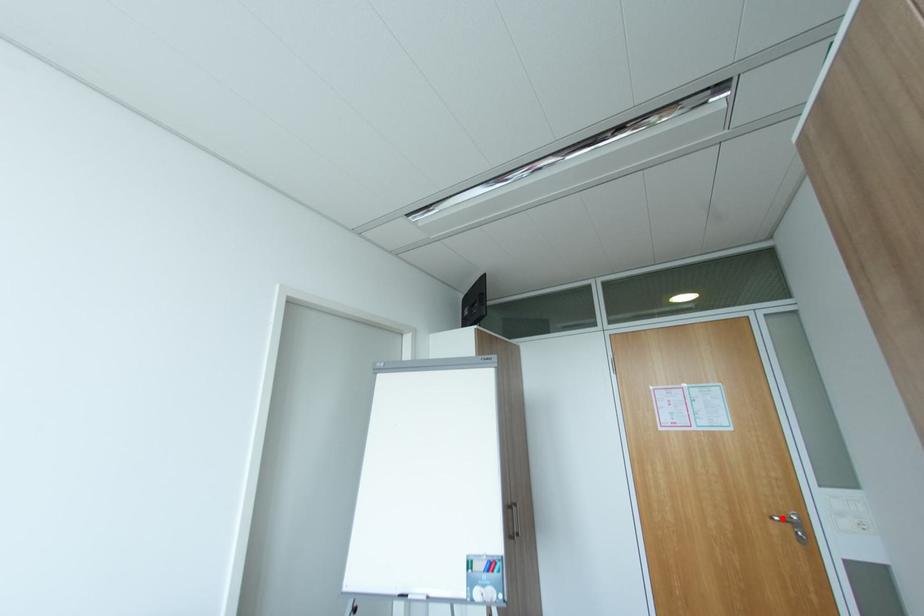
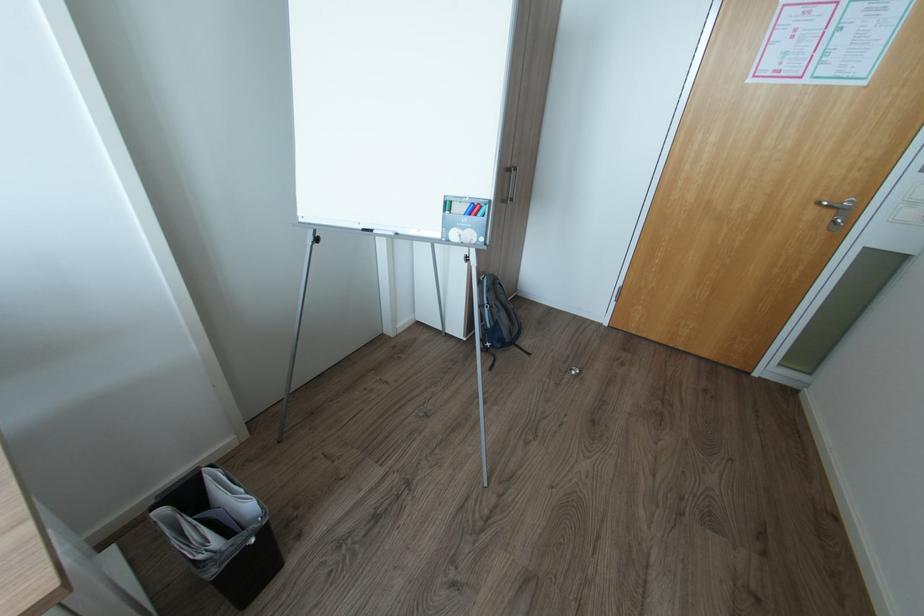
Question: I am providing you with two images of the same scene from different viewpoints. A red point is shown in image1. For the corresponding object point in image2, is it positioned nearer or farther from the camera?

Choices:
 (A) Nearer
 (B) Farther

Answer: (B)